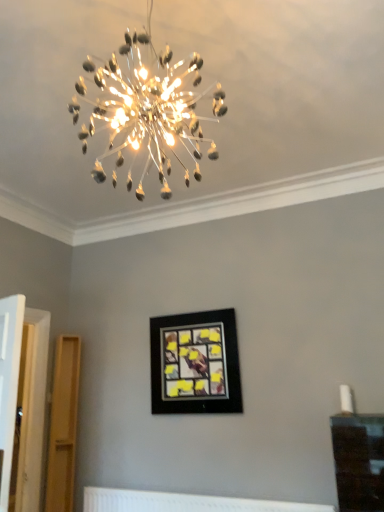
Question: In the image, is white textured radiator at lower center positioned in front of or behind black matte picture frame at center?

Choices:
 (A) front
 (B) behind

Answer: (A)

Question: In terms of height, does white textured radiator at lower center look taller or shorter compared to black matte picture frame at center?

Choices:
 (A) tall
 (B) short

Answer: (B)

Question: Estimate the real-world distances between objects in this image. Which object is farther from the white textured radiator at lower center?

Choices:
 (A) black matte picture frame at center
 (B) clear glass chandelier at upper center

Answer: (B)

Question: Estimate the real-world distances between objects in this image. Which object is closer to the black matte picture frame at center?

Choices:
 (A) white textured radiator at lower center
 (B) clear glass chandelier at upper center

Answer: (A)